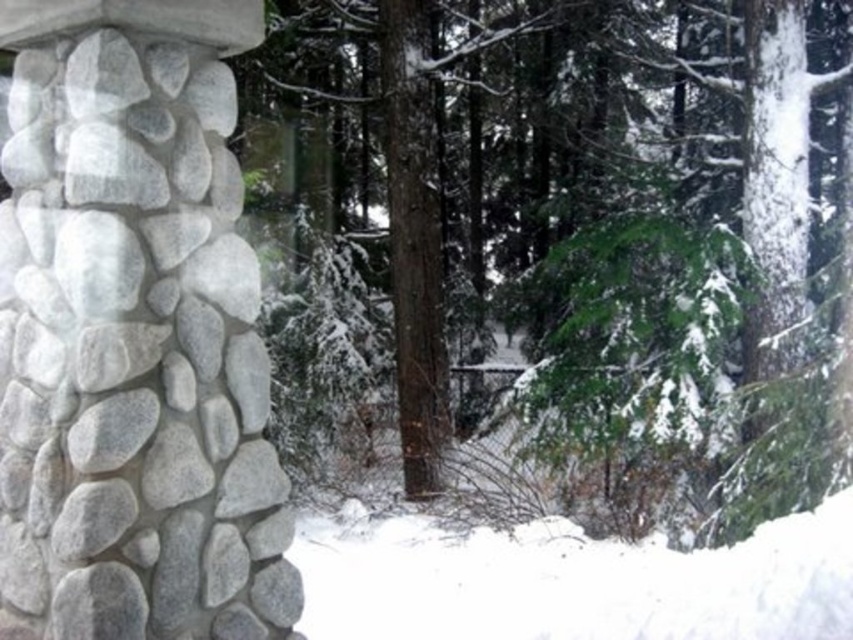
Question: Can you confirm if gray stone column at left is wider than white fluffy snow at lower center?

Choices:
 (A) no
 (B) yes

Answer: (A)

Question: Among these objects, which one is nearest to the camera?

Choices:
 (A) gray stone column at left
 (B) white fluffy snow at lower center
 (C) green textured evergreen tree at center

Answer: (A)

Question: From the image, what is the correct spatial relationship of gray stone column at left in relation to white fluffy snow at lower center?

Choices:
 (A) left
 (B) right

Answer: (A)

Question: Which object is positioned closest to the gray stone column at left?

Choices:
 (A) green textured evergreen tree at center
 (B) white fluffy snow at lower center

Answer: (B)

Question: Does gray stone column at left have a larger size compared to white fluffy snow at lower center?

Choices:
 (A) no
 (B) yes

Answer: (B)

Question: Which object is closer to the camera taking this photo?

Choices:
 (A) white fluffy snow at lower center
 (B) green textured evergreen tree at center

Answer: (B)